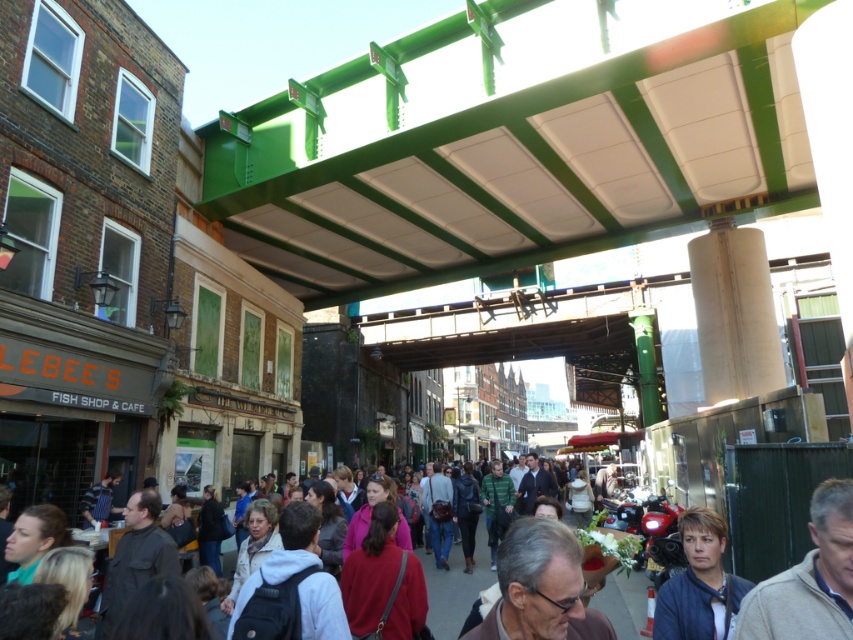
Who is higher up, light brown leather jacket at lower right or dark blue jacket at lower right?

light brown leather jacket at lower right is higher up.

Who is more forward, (840, 522) or (676, 604)?

Point (840, 522)

Does point (811, 540) come closer to viewer compared to point (711, 552)?

No, (811, 540) is behind (711, 552).

This screenshot has height=640, width=853. What are the coordinates of `light brown leather jacket at lower right` in the screenshot? It's located at (809, 579).